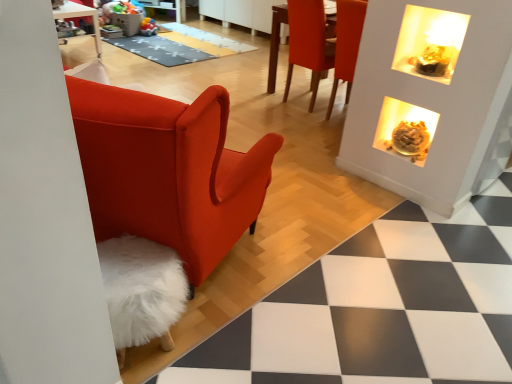
Question: Should I look upward or downward to see matte orange chair at upper right?

Choices:
 (A) down
 (B) up

Answer: (B)

Question: Is the position of gray textured mat at center more distant than that of translucent glass bowl at upper right?

Choices:
 (A) no
 (B) yes

Answer: (B)

Question: Can you confirm if gray textured mat at center is thinner than translucent glass bowl at upper right?

Choices:
 (A) no
 (B) yes

Answer: (A)

Question: Does gray textured mat at center have a greater height compared to translucent glass bowl at upper right?

Choices:
 (A) no
 (B) yes

Answer: (A)

Question: Is there a large distance between gray textured mat at center and translucent glass bowl at upper right?

Choices:
 (A) yes
 (B) no

Answer: (A)

Question: Could you tell me if gray textured mat at center is facing translucent glass bowl at upper right?

Choices:
 (A) yes
 (B) no

Answer: (B)

Question: Is translucent glass bowl at upper right inside gray textured mat at center?

Choices:
 (A) yes
 (B) no

Answer: (B)

Question: Is translucent glass bowl at upper right thinner than gray textured mat at center?

Choices:
 (A) no
 (B) yes

Answer: (B)

Question: Can you confirm if translucent glass bowl at upper right is taller than gray textured mat at center?

Choices:
 (A) no
 (B) yes

Answer: (B)

Question: Is translucent glass bowl at upper right not close to gray textured mat at center?

Choices:
 (A) yes
 (B) no

Answer: (A)

Question: Is translucent glass bowl at upper right smaller than gray textured mat at center?

Choices:
 (A) yes
 (B) no

Answer: (A)

Question: Is the surface of translucent glass bowl at upper right in direct contact with gray textured mat at center?

Choices:
 (A) yes
 (B) no

Answer: (B)

Question: From the image's perspective, is translucent glass bowl at upper right located above gray textured mat at center?

Choices:
 (A) no
 (B) yes

Answer: (A)

Question: From a real-world perspective, is matte orange chair at upper right under gray textured mat at center?

Choices:
 (A) no
 (B) yes

Answer: (A)